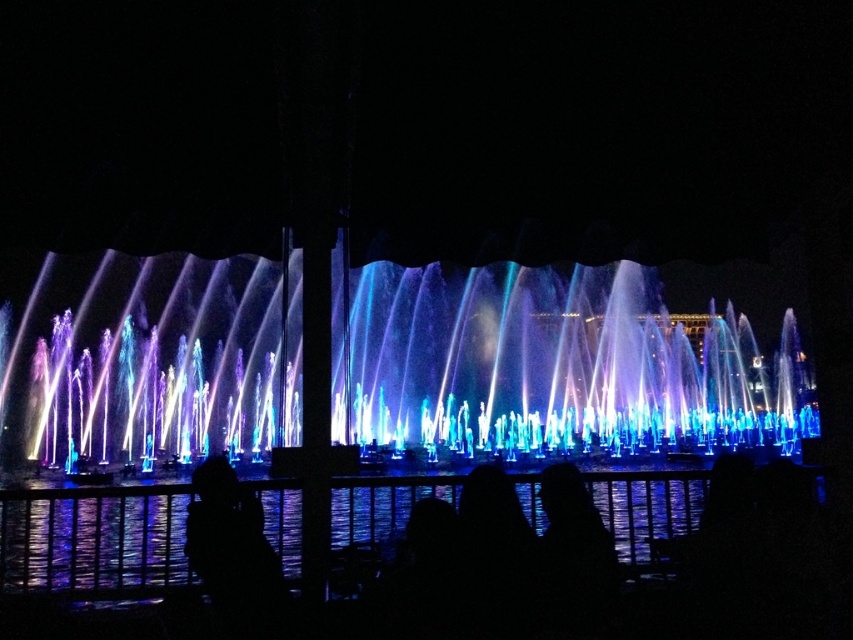
You are standing at the edge of the fountain and see the iridescent water at center and the black matte person at lower left. Which object is closer to your current position?

The black matte person at lower left is closer to your current position since they are located at the lower left, while the iridescent water at center is positioned to the right of them, further away.

You are a photographer standing at the edge of the fountain. You want to capture a photo where both the blue reflective water at center and the black matte person at lower left are clearly visible. Based on their positions, which object is closer to you?

The black matte person at lower left is closer to you since they are positioned at the lower left, while the blue reflective water at center is further away in the central area of the scene.